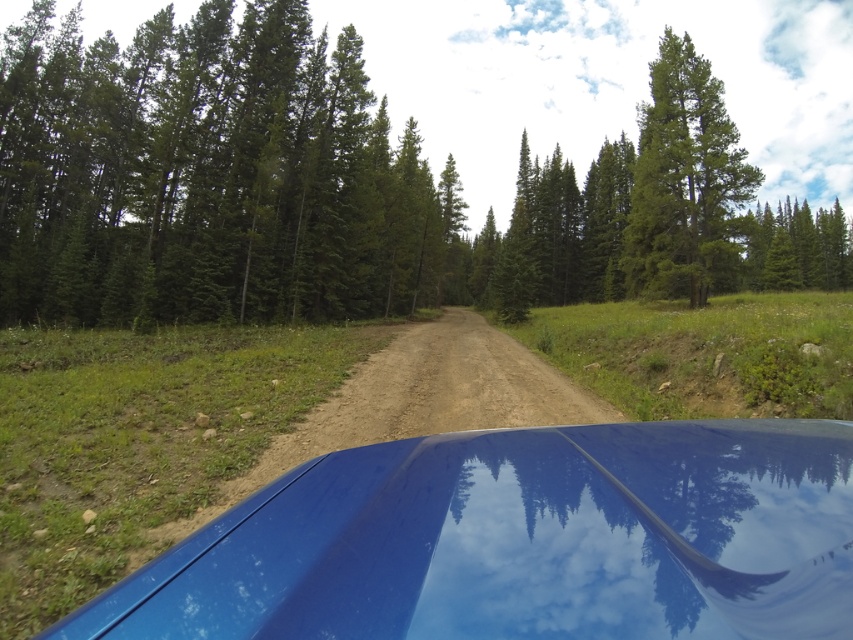
Between green matte tree at center and glossy blue car at center, which one appears on the right side from the viewer's perspective?

Positioned to the right is green matte tree at center.

Which is above, green matte tree at center or glossy blue car at center?

green matte tree at center is higher up.

Does point (227, 140) come closer to viewer compared to point (109, 609)?

No, (227, 140) is further to viewer.

Find the location of a particular element. The height and width of the screenshot is (640, 853). green matte tree at center is located at coordinates (346, 186).

What do you see at coordinates (346, 186) in the screenshot? The height and width of the screenshot is (640, 853). I see `green matte tree at center` at bounding box center [346, 186].

Can you confirm if green matte tree at center is shorter than green matte tree at upper right?

No, green matte tree at center is not shorter than green matte tree at upper right.

I want to click on green matte tree at center, so click(346, 186).

What do you see at coordinates (520, 540) in the screenshot? This screenshot has height=640, width=853. I see `glossy blue car at center` at bounding box center [520, 540].

Does glossy blue car at center appear on the left side of green matte tree at upper right?

Yes, glossy blue car at center is to the left of green matte tree at upper right.

The image size is (853, 640). What do you see at coordinates (520, 540) in the screenshot? I see `glossy blue car at center` at bounding box center [520, 540].

Where is `glossy blue car at center`? The height and width of the screenshot is (640, 853). glossy blue car at center is located at coordinates (520, 540).